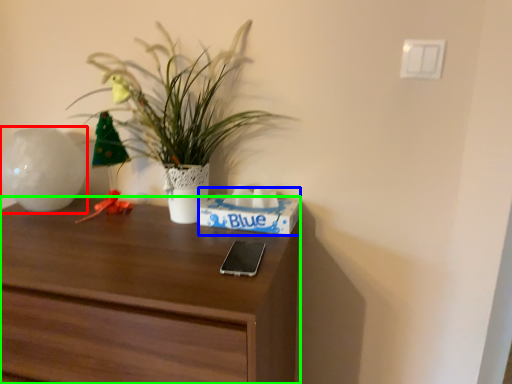
Question: Which object is the closest to the vase (highlighted by a red box)? Choose among these: shoe box (highlighted by a blue box) or desk (highlighted by a green box).

Choices:
 (A) shoe box
 (B) desk

Answer: (B)